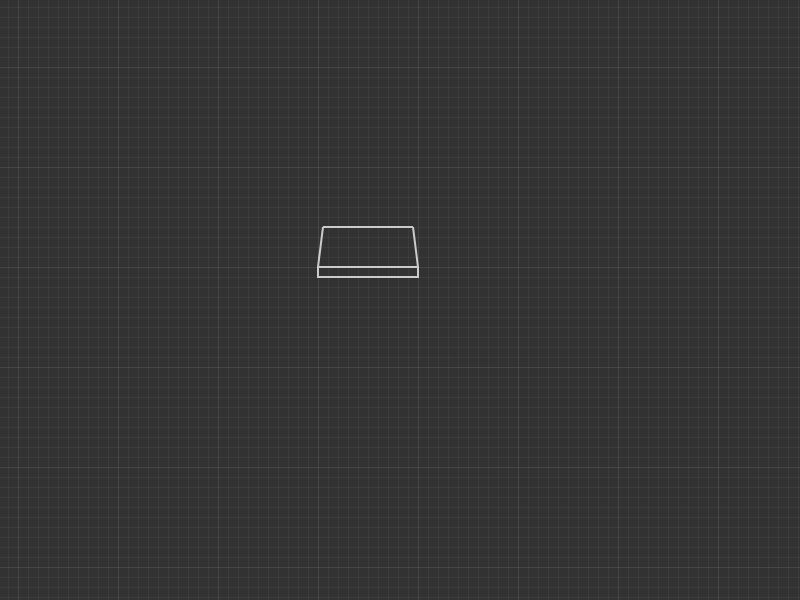
Where is `box`? box is located at coordinates tap(564, 350).